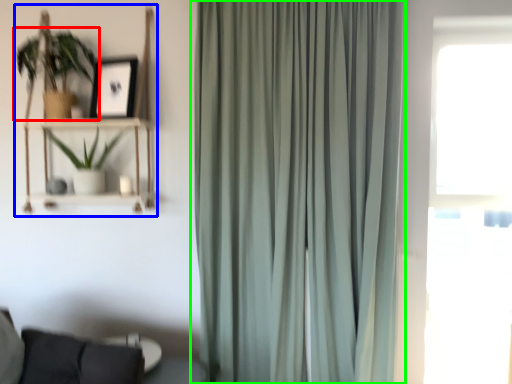
Question: Considering the real-world distances, which object is closest to houseplant (highlighted by a red box)? bookshelf (highlighted by a blue box) or curtain (highlighted by a green box).

Choices:
 (A) bookshelf
 (B) curtain

Answer: (A)